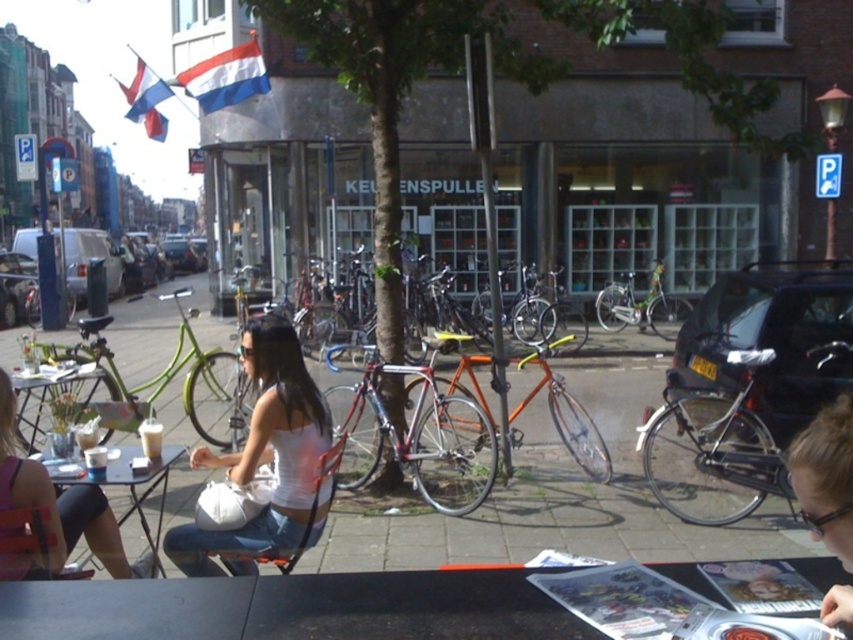
Question: Is white matte tank top at center further to the viewer compared to orange metallic bicycle at center?

Choices:
 (A) yes
 (B) no

Answer: (B)

Question: Which of the following is the closest to the observer?

Choices:
 (A) shiny metallic bicycle at center
 (B) orange metallic bicycle at center
 (C) matte white tank top at center

Answer: (C)

Question: Is metallic silver table at lower left to the right of green matte bicycle at center from the viewer's perspective?

Choices:
 (A) yes
 (B) no

Answer: (B)

Question: Observing the image, what is the correct spatial positioning of clear plastic glasses at lower right in reference to matte black table at lower left?

Choices:
 (A) below
 (B) above

Answer: (B)

Question: Among these points, which one is nearest to the camera?

Choices:
 (A) (x=3, y=531)
 (B) (x=428, y=449)
 (C) (x=608, y=292)

Answer: (A)

Question: Among these points, which one is nearest to the camera?

Choices:
 (A) (447, 420)
 (B) (161, 500)

Answer: (B)